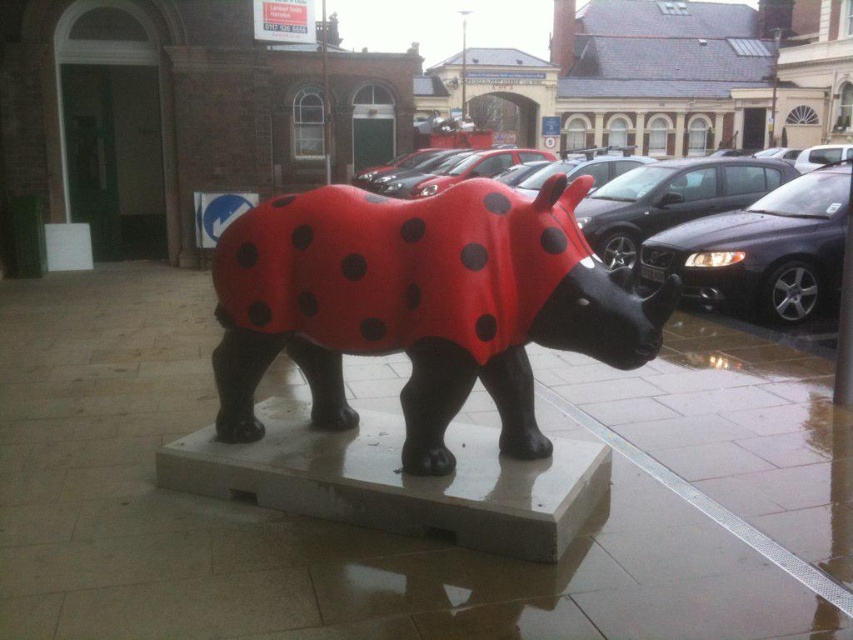
You are a delivery person who needs to park your 12 feet long delivery van between the matte red rhino at center and the shiny black car at center. Can you fit your van between them without touching either?

The distance between the matte red rhino at center and the shiny black car at center is 13.20 feet. Since your van is 12 feet long, there is enough space to park it between them without touching either object.

You are a delivery person trying to park your van near the sculpture. The van requires a parking space that can accommodate vehicles up to the size of the matte black car at right. Is the space next to the matte red rhino at center large enough?

The matte red rhino at center is smaller than the matte black car at right. Since the parking space must accommodate vehicles as large as the matte black car at right, the space next to the matte red rhino at center may be sufficient if it can fit the matte black car at right. However, the size of the rhino itself does not indicate the parking space dimensions. Please check the actual space availability.

You are a delivery person with a package that needs to be placed between the shiny black car at center and the matte black car at right. The package requires a minimum of 3 feet of space to be safely placed. Can you fit it there?

The shiny black car at center is 34.76 inches away from matte black car at right. Since 34.76 inches is approximately 2.89 feet, which is less than the required 3 feet, the package cannot be safely placed between them.